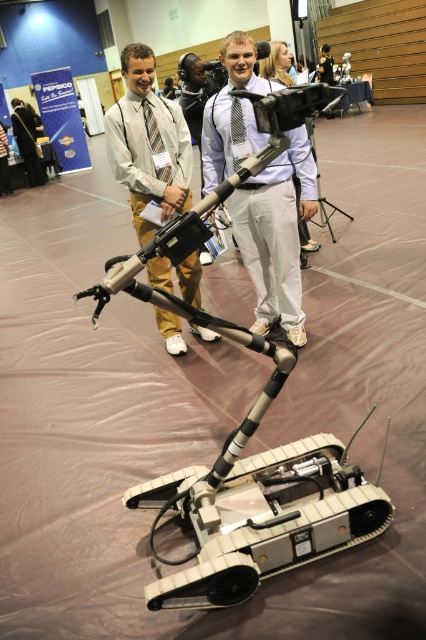
Is black plastic tripod at center shorter than black leather jacket at center?

Yes.

Does black plastic tripod at center have a greater width compared to black leather jacket at center?

Correct, the width of black plastic tripod at center exceeds that of black leather jacket at center.

Does point (307, 125) come closer to viewer compared to point (319, 74)?

Yes, it is.

I want to click on black plastic tripod at center, so tap(319, 189).

Which is behind, point (129, 113) or point (325, 52)?

The point (325, 52) is behind.

Does point (178, 115) lie behind point (322, 74)?

No, (178, 115) is closer to viewer.

Identify the location of matte khaki pants at center. (147, 144).

Find the location of `matte khaki pants at center`. matte khaki pants at center is located at coordinates (147, 144).

Who is taller, matte khaki pants at center or black plastic tripod at center?

Standing taller between the two is matte khaki pants at center.

This screenshot has height=640, width=426. What do you see at coordinates (147, 144) in the screenshot?
I see `matte khaki pants at center` at bounding box center [147, 144].

Locate an element on the screen. matte khaki pants at center is located at coordinates (147, 144).